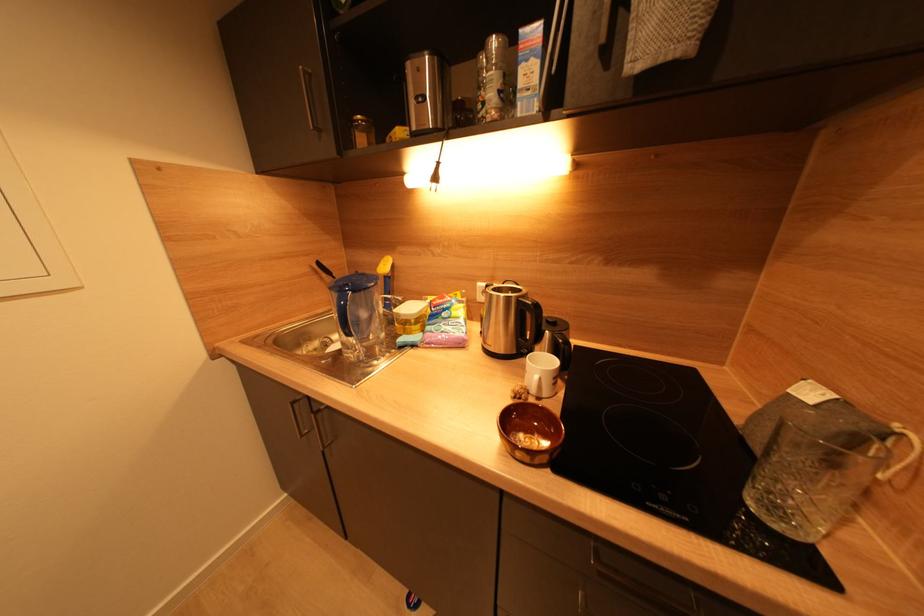
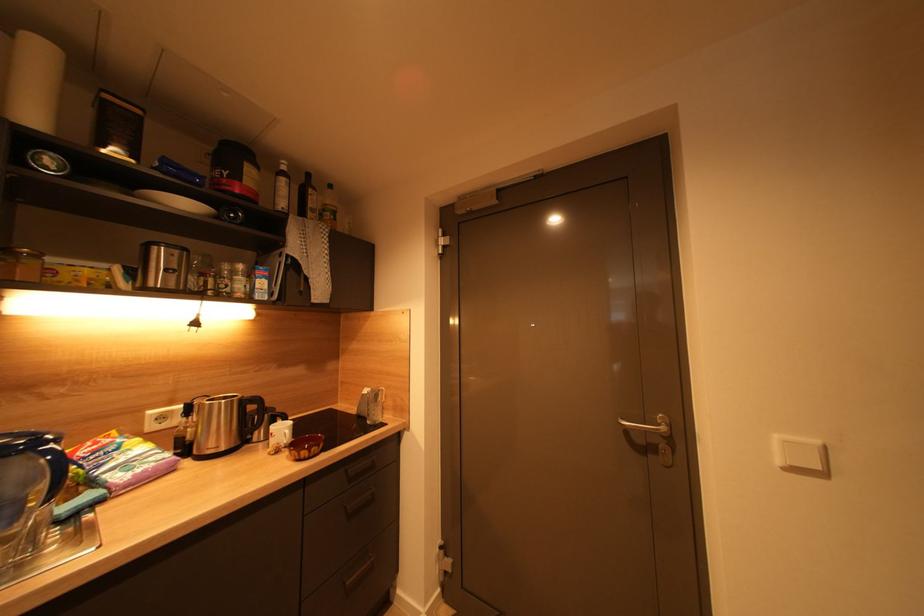
Question: How did the camera likely rotate?

Choices:
 (A) Left
 (B) Right
 (C) Up
 (D) Down

Answer: (B)